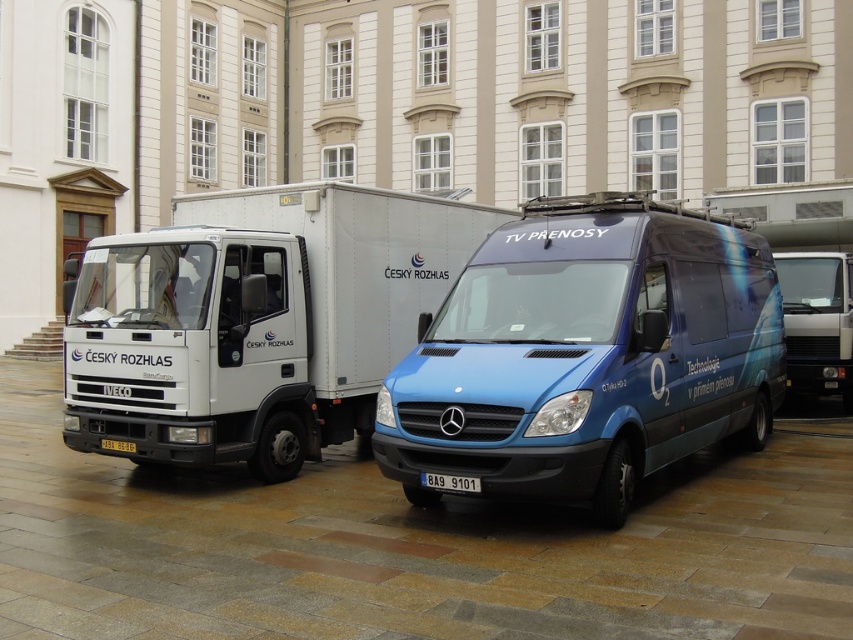
You are a delivery driver who needs to park your van between the blue metallic van at center and the metallic silver van at center. The length of your van is 20 feet. Is there enough space between them to park your van?

The blue metallic van at center and metallic silver van at center are 27.40 feet apart from each other. Since your van is 20 feet long, there is sufficient space to park between them as 27.40 feet is greater than 20 feet.

You are a delivery person who needs to park your vehicle between the white Iveco truck and the classical building. The blue metallic van at center and the white plastic license plate at center are in your way. Which object should you move first to clear the path?

The blue metallic van at center is to the left of white plastic license plate at center, so you should move the blue metallic van at center first to clear the path.